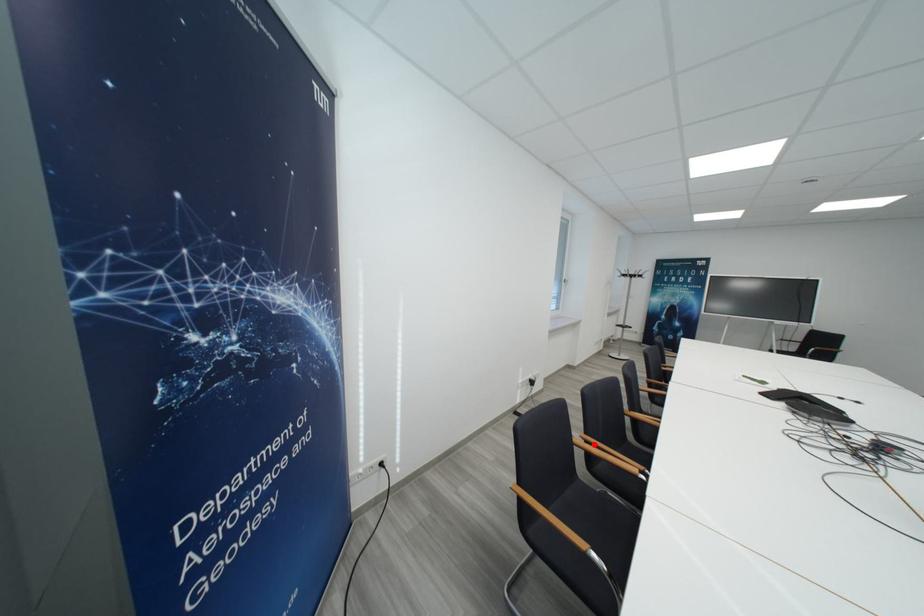
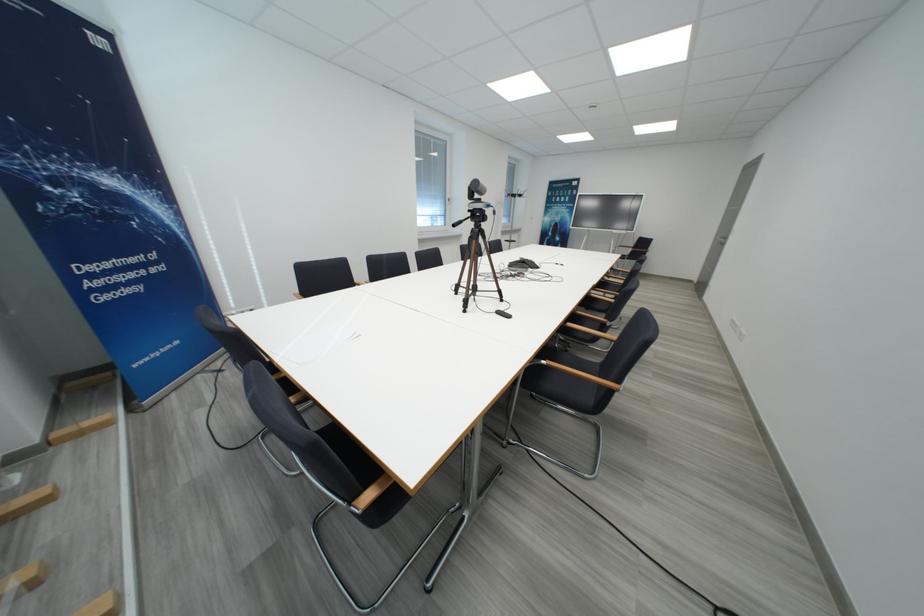
Question: I am providing you with two images of the same scene from different viewpoints. A red point is marked on the first image. At the location where the point appears in image 1, is it still visible in image 2?

Choices:
 (A) Yes
 (B) No

Answer: (B)